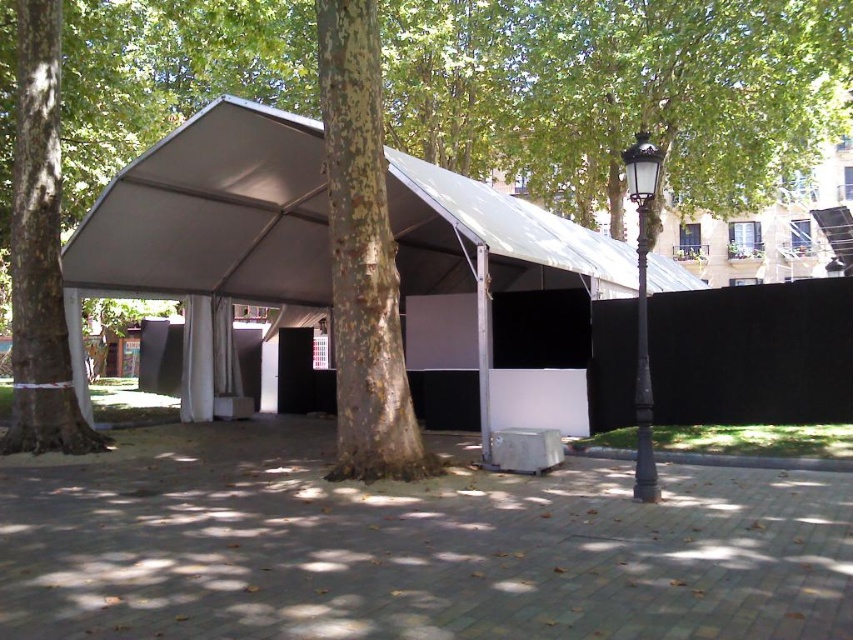
From the picture: You are planning to set up a picnic blanket in the park. You want to ensure it is placed under the white fabric tent at center but also close to the green leafy tree at center for shade. Considering their sizes, which object should you position your blanket closer to for maximum coverage?

The white fabric tent at center is bigger than the green leafy tree at center, so positioning the picnic blanket closer to the white fabric tent at center would provide more coverage.

You are standing at the entrance of the park and want to take a photo of the white fabric tent at center and the green leafy tree at center. Which object should you focus on first to ensure both are in the frame?

The white fabric tent at center is in front of the green leafy tree at center, so you should focus on the white fabric tent at center first to ensure both are in the frame.

You are a park visitor holding a 3 meter long ladder. You want to place it between the white fabric tent at center and the green leafy tree at center. Is there enough space to place the ladder horizontally between them?

The distance between the white fabric tent at center and the green leafy tree at center is 7.99 meters. Since the ladder is 3 meters long, there is sufficient space to place it horizontally between them.